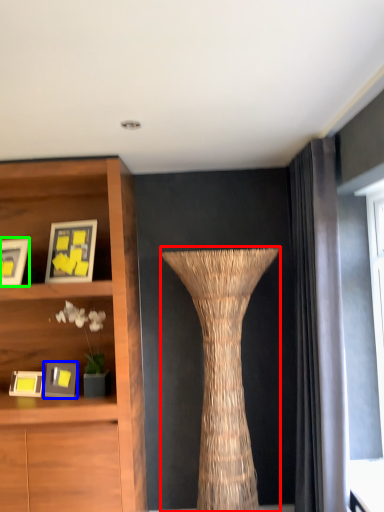
Question: Based on their relative distances, which object is nearer to vase (highlighted by a red box)? Choose from picture frame (highlighted by a blue box) and picture frame (highlighted by a green box).

Choices:
 (A) picture frame
 (B) picture frame

Answer: (A)